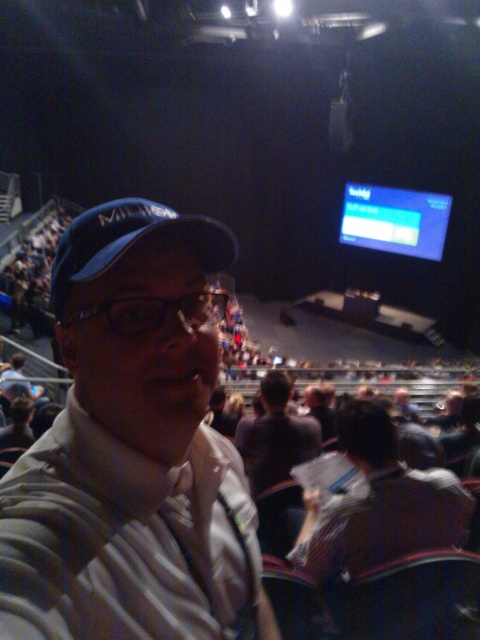
You are organizing a photo shoot in this auditorium and need to ensure that the striped cotton shirt at center and the matte blue screen at upper right are both visible in the frame. Given their sizes, which object should you prioritize positioning closer to the camera to maintain clarity?

The striped cotton shirt at center should be positioned closer to the camera since it occupies less space than the matte blue screen at upper right, making it smaller and potentially harder to see from a distance.

You are standing at the entrance of the auditorium and see two points marked in the image. The first point is at coordinates point (158, 221) and the second is at point (346, 216). Which point is closer to you?

Point (158, 221) is in front of point (346, 216), so the first point is closer to you.

You are a photographer in the audience and want to capture a photo of the striped cotton shirt at center without the matte blue screen at upper right appearing in the shot. Is this possible?

The striped cotton shirt at center is positioned under the matte blue screen at upper right, so if you angle your camera downward slightly, you can capture the striped cotton shirt at center without the matte blue screen at upper right being visible.